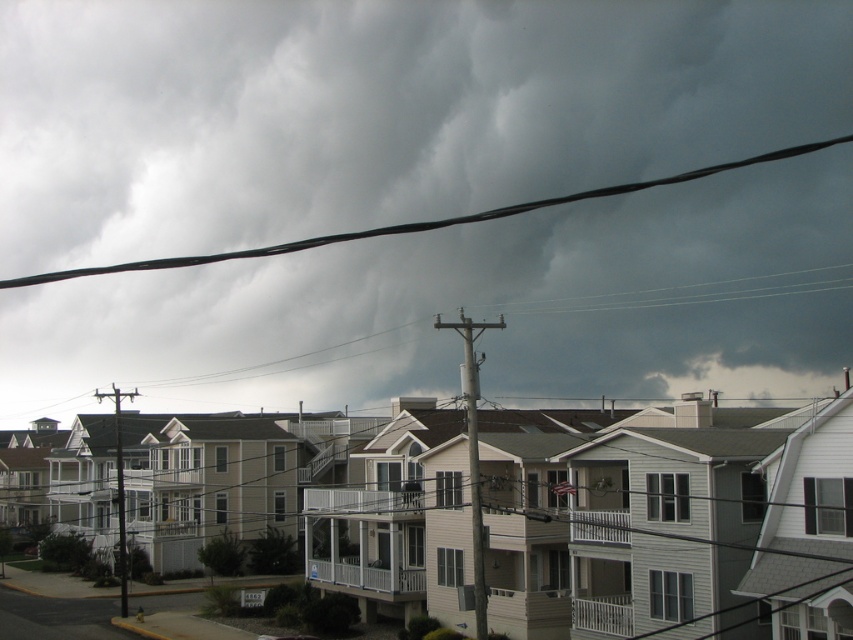
Question: Does black wire at upper center lie in front of gray metallic pole at center?

Choices:
 (A) yes
 (B) no

Answer: (B)

Question: Which of these objects is positioned closest to the dark gray cloud at upper center?

Choices:
 (A) gray metallic pole at center
 (B) black wire at upper center

Answer: (B)

Question: Is dark gray cloud at upper center behind gray metallic pole at center?

Choices:
 (A) no
 (B) yes

Answer: (B)

Question: Among these points, which one is nearest to the camera?

Choices:
 (A) (664, 180)
 (B) (560, 134)

Answer: (B)

Question: Does black wire at upper center have a smaller size compared to gray metallic pole at center?

Choices:
 (A) no
 (B) yes

Answer: (A)

Question: Which object is the farthest from the black wire at upper center?

Choices:
 (A) dark gray cloud at upper center
 (B) gray metallic pole at center

Answer: (B)